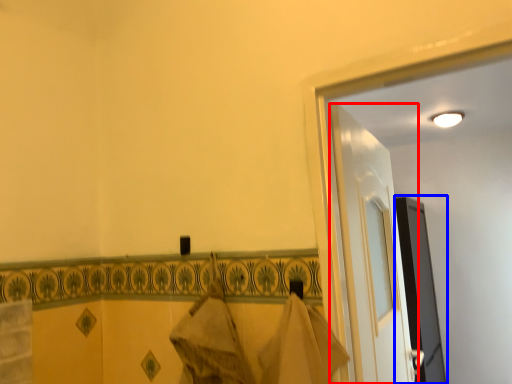
Question: Which of the following is the farthest to the observer, door (highlighted by a red box) or screen door (highlighted by a blue box)?

Choices:
 (A) door
 (B) screen door

Answer: (B)